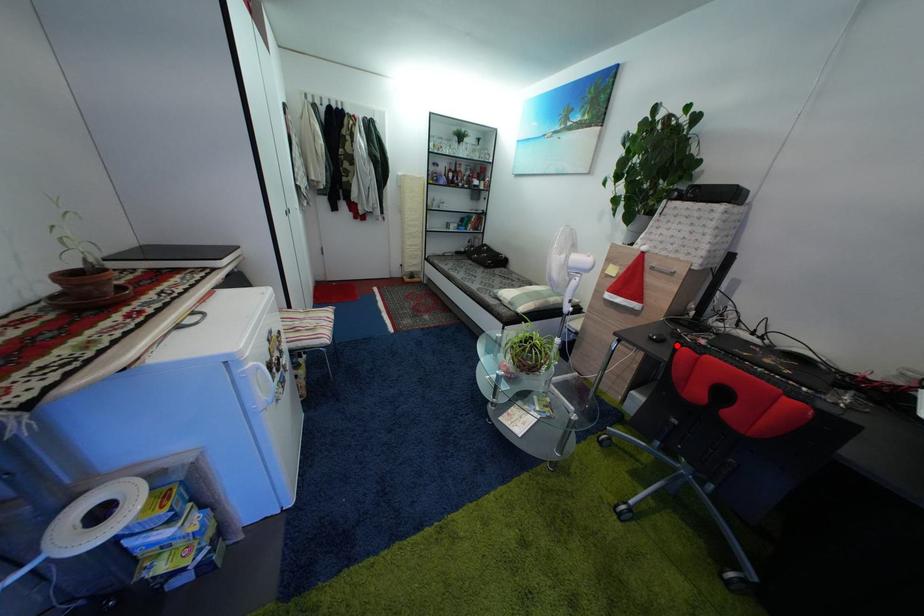
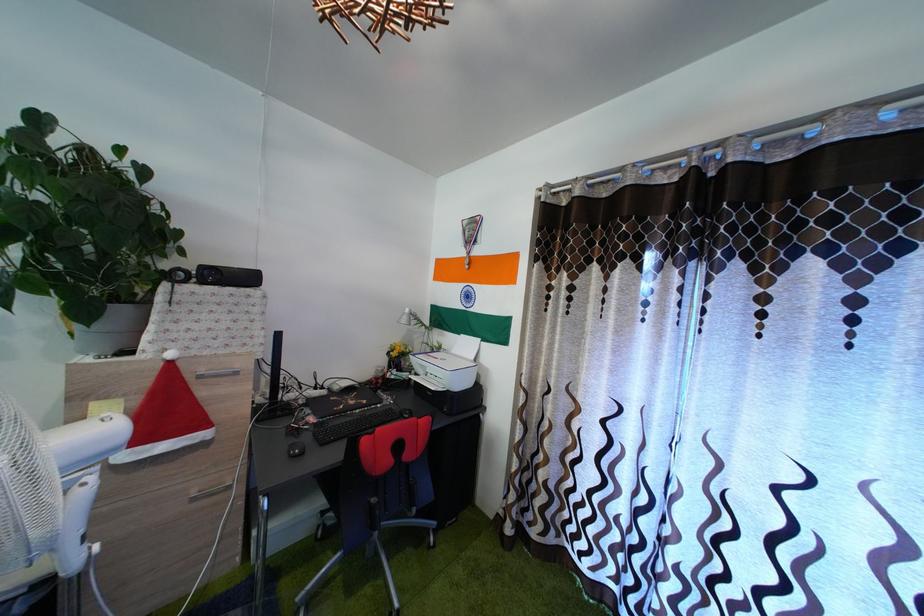
Locate, in the second image, the point that corresponds to the highlighted location in the first image.

(304, 448)